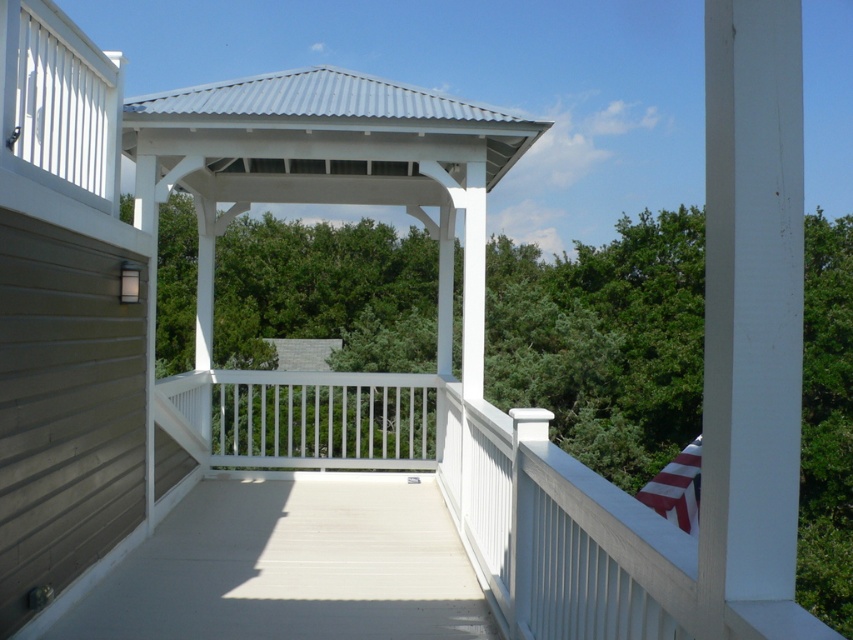
Find the location of a particular element. This screenshot has width=853, height=640. white painted wood balustrade at center is located at coordinates [300, 417].

Is white painted wood balustrade at center above striped fabric flag at lower right?

Yes, white painted wood balustrade at center is above striped fabric flag at lower right.

Is point (431, 442) closer to viewer compared to point (680, 480)?

Yes, it is in front of point (680, 480).

Identify the location of white painted wood balustrade at center. This screenshot has height=640, width=853. (300, 417).

Does point (334, 528) come in front of point (688, 490)?

Yes, it is.

Between white matte deck at center and striped fabric flag at lower right, which one has less height?

white matte deck at center is shorter.

Is point (364, 627) in front of point (670, 500)?

Yes, it is in front of point (670, 500).

At what (x,y) coordinates should I click in order to perform the action: click on white matte deck at center. Please return your answer as a coordinate pair (x, y). The image size is (853, 640). Looking at the image, I should click on (292, 566).

Can you confirm if white matte deck at center is positioned to the right of white painted wood balustrade at center?

Yes, white matte deck at center is to the right of white painted wood balustrade at center.

Is white matte deck at center smaller than white painted wood balustrade at center?

Indeed, white matte deck at center has a smaller size compared to white painted wood balustrade at center.

Is point (374, 573) positioned after point (271, 378)?

No, (374, 573) is in front of (271, 378).

At what (x,y) coordinates should I click in order to perform the action: click on white matte deck at center. Please return your answer as a coordinate pair (x, y). The image size is (853, 640). Looking at the image, I should click on (292, 566).